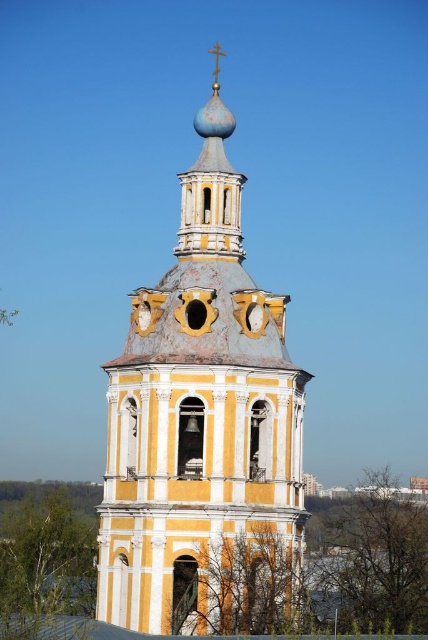
Question: Where is yellow painted wood bell tower at center located in relation to gold-painted wood spire at center in the image?

Choices:
 (A) right
 (B) left

Answer: (A)

Question: Which point is closer to the camera?

Choices:
 (A) (195, 467)
 (B) (190, 228)

Answer: (A)

Question: Does yellow painted wood bell tower at center come behind gold-painted wood spire at center?

Choices:
 (A) no
 (B) yes

Answer: (A)

Question: Among these objects, which one is farthest from the camera?

Choices:
 (A) gold-painted wood spire at center
 (B) yellow painted wood bell tower at center

Answer: (A)

Question: Does yellow painted wood bell tower at center have a larger size compared to gold-painted wood spire at center?

Choices:
 (A) no
 (B) yes

Answer: (B)